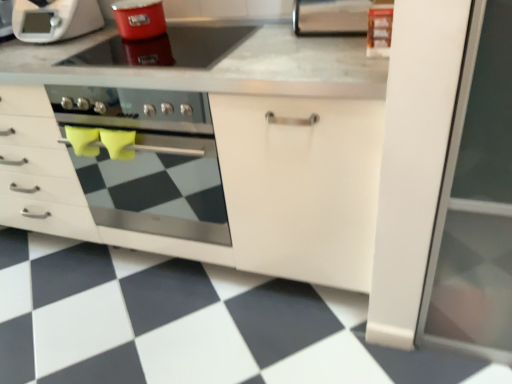
Question: Does stainless steel oven at center lie in front of shiny red pot at upper center?

Choices:
 (A) no
 (B) yes

Answer: (B)

Question: Considering the relative sizes of stainless steel oven at center and shiny red pot at upper center in the image provided, is stainless steel oven at center shorter than shiny red pot at upper center?

Choices:
 (A) yes
 (B) no

Answer: (B)

Question: From the image's perspective, is stainless steel oven at center located above shiny red pot at upper center?

Choices:
 (A) no
 (B) yes

Answer: (A)

Question: Is stainless steel oven at center not within shiny red pot at upper center?

Choices:
 (A) yes
 (B) no

Answer: (A)

Question: Is stainless steel oven at center further to camera compared to shiny red pot at upper center?

Choices:
 (A) no
 (B) yes

Answer: (A)

Question: Is stainless steel oven at center positioned with its back to shiny red pot at upper center?

Choices:
 (A) yes
 (B) no

Answer: (B)

Question: Is white matte cabinet at center wider than matte red pot at upper center?

Choices:
 (A) yes
 (B) no

Answer: (A)

Question: Can you confirm if white matte cabinet at center is positioned to the right of matte red pot at upper center?

Choices:
 (A) no
 (B) yes

Answer: (A)

Question: Is white matte cabinet at center positioned with its back to matte red pot at upper center?

Choices:
 (A) yes
 (B) no

Answer: (B)

Question: Considering the relative sizes of white matte cabinet at center and matte red pot at upper center in the image provided, is white matte cabinet at center bigger than matte red pot at upper center?

Choices:
 (A) yes
 (B) no

Answer: (A)

Question: Is white matte cabinet at center touching matte red pot at upper center?

Choices:
 (A) yes
 (B) no

Answer: (B)

Question: Is the depth of white matte cabinet at center greater than that of matte red pot at upper center?

Choices:
 (A) yes
 (B) no

Answer: (B)

Question: Is white matte cabinet at center smaller than metallic stainless steel paper towel holder at upper center?

Choices:
 (A) no
 (B) yes

Answer: (A)